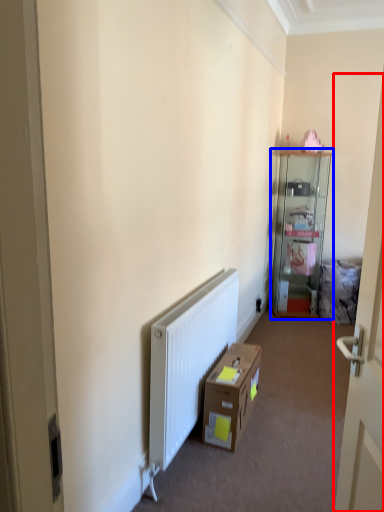
Question: Which point is closer to the camera, door (highlighted by a red box) or cabinetry (highlighted by a blue box)?

Choices:
 (A) door
 (B) cabinetry

Answer: (A)